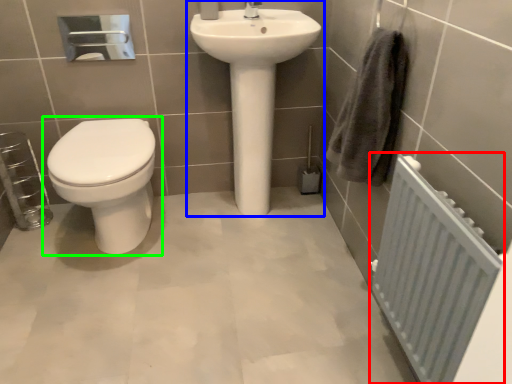
Question: Based on their relative distances, which object is farther from radiator (highlighted by a red box)? Choose from sink (highlighted by a blue box) and toilet (highlighted by a green box).

Choices:
 (A) sink
 (B) toilet

Answer: (B)